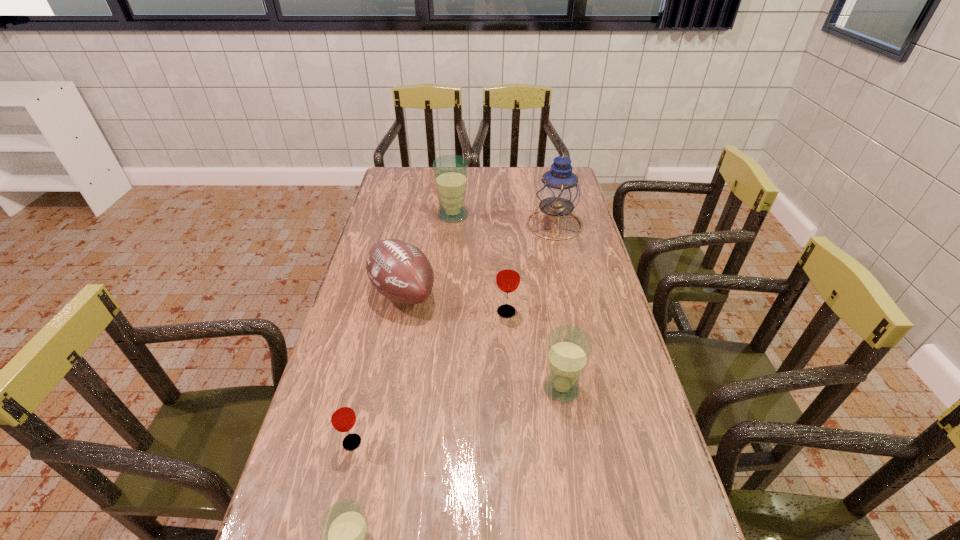
Find the location of a particular element. the left red glass is located at coordinates (342, 416).

Where is `vacant point located on the front-facing side of the lantern`? vacant point located on the front-facing side of the lantern is located at coordinates (454, 225).

Where is `vacant region located 0.190m on the front-facing side of the lantern`? This screenshot has width=960, height=540. vacant region located 0.190m on the front-facing side of the lantern is located at coordinates (477, 225).

You are a GUI agent. You are given a task and a screenshot of the screen. Output one action in this format:
    pyautogui.click(x=<x>, y=<y>)
    Task: Click on the vacant space located 0.150m on the front-facing side of the lantern
    The width and height of the screenshot is (960, 540).
    Given the screenshot: What is the action you would take?
    pyautogui.click(x=488, y=225)

Image resolution: width=960 pixels, height=540 pixels. In order to click on blank space located 0.300m on the front of the tallest glass in this screenshot , I will do `click(447, 276)`.

Locate an element on the screen. Image resolution: width=960 pixels, height=540 pixels. blank area located 0.190m on the back of the football (American) is located at coordinates (414, 236).

This screenshot has width=960, height=540. Find the location of `free space located 0.330m on the left of the second farthest glass`. free space located 0.330m on the left of the second farthest glass is located at coordinates (386, 312).

Find the location of `vacant point located 0.190m on the left of the rightmost glass`. vacant point located 0.190m on the left of the rightmost glass is located at coordinates (467, 388).

Locate an element on the screen. The width and height of the screenshot is (960, 540). blank area located on the back of the nearer red glass is located at coordinates (369, 369).

Locate an element on the screen. The height and width of the screenshot is (540, 960). football (American) situated at the left edge is located at coordinates (401, 272).